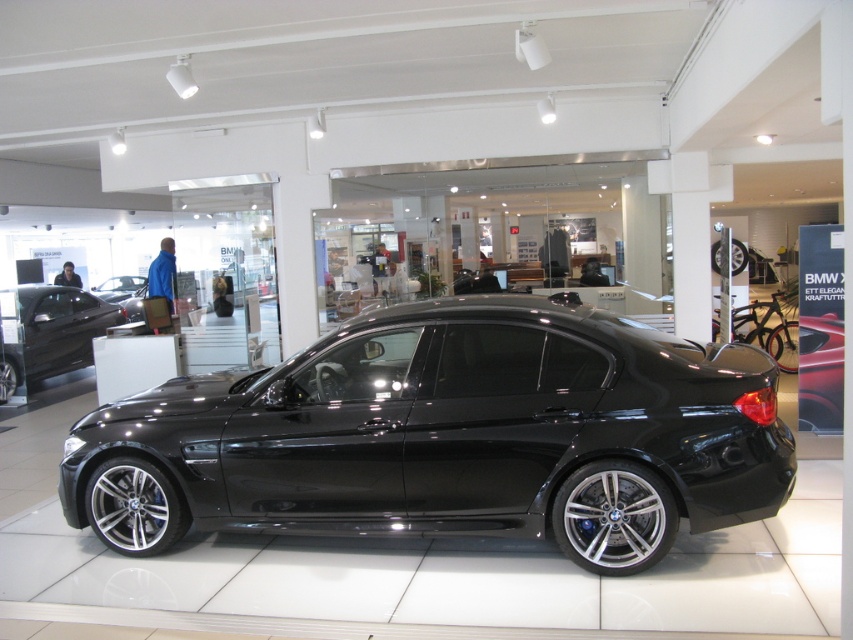
Question: Is black metallic car at center thinner than matte black sedan at left?

Choices:
 (A) yes
 (B) no

Answer: (B)

Question: Among these points, which one is nearest to the camera?

Choices:
 (A) (636, 342)
 (B) (32, 300)
 (C) (96, 289)

Answer: (A)

Question: Which point is closer to the camera taking this photo?

Choices:
 (A) (39, 324)
 (B) (132, 289)

Answer: (A)

Question: Which object is the farthest from the glossy black car at center?

Choices:
 (A) black metallic car at center
 (B) matte black sedan at left

Answer: (A)

Question: Does matte black sedan at left come in front of glossy black car at center?

Choices:
 (A) yes
 (B) no

Answer: (A)

Question: Is black metallic car at center smaller than matte black sedan at left?

Choices:
 (A) no
 (B) yes

Answer: (A)